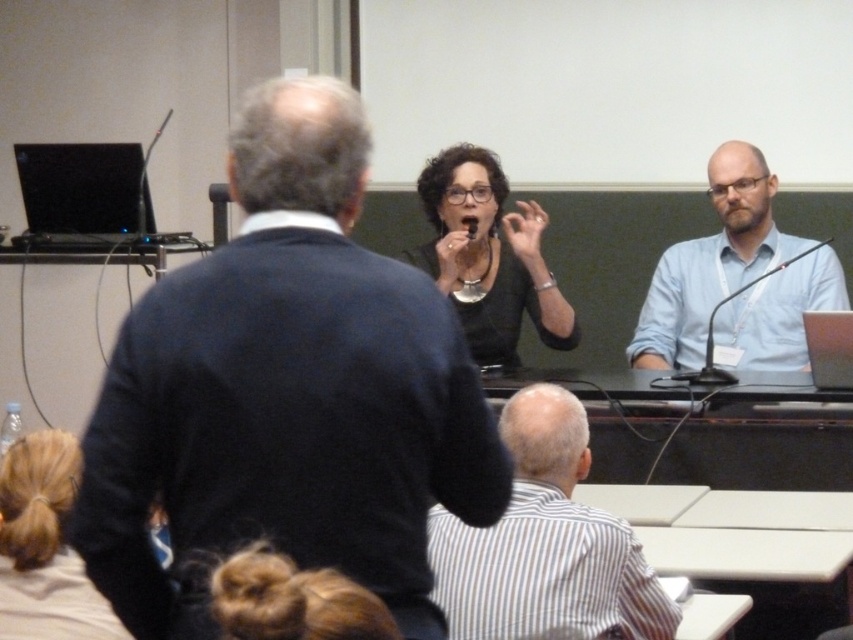
Does light blue shirt at upper right appear under matte black shirt at center?

Yes, light blue shirt at upper right is below matte black shirt at center.

Measure the distance between light blue shirt at upper right and matte black shirt at center.

A distance of 26.78 inches exists between light blue shirt at upper right and matte black shirt at center.

Is point (735, 330) positioned after point (453, 298)?

Yes, point (735, 330) is behind point (453, 298).

Where is `light blue shirt at upper right`? light blue shirt at upper right is located at coordinates (735, 280).

You are a GUI agent. You are given a task and a screenshot of the screen. Output one action in this format:
    pyautogui.click(x=<x>, y=<y>)
    Task: Click on the white striped shirt at lower center
    Image resolution: width=853 pixels, height=640 pixels.
    Given the screenshot: What is the action you would take?
    pyautogui.click(x=544, y=545)

Describe the element at coordinates (544, 545) in the screenshot. I see `white striped shirt at lower center` at that location.

At what (x,y) coordinates should I click in order to perform the action: click on white striped shirt at lower center. Please return your answer as a coordinate pair (x, y). Looking at the image, I should click on (544, 545).

How much distance is there between white striped shirt at lower center and matte black shirt at center?

white striped shirt at lower center is 4.45 feet away from matte black shirt at center.

Does white striped shirt at lower center have a greater width compared to matte black shirt at center?

No, white striped shirt at lower center is not wider than matte black shirt at center.

Where is `white striped shirt at lower center`? white striped shirt at lower center is located at coordinates (544, 545).